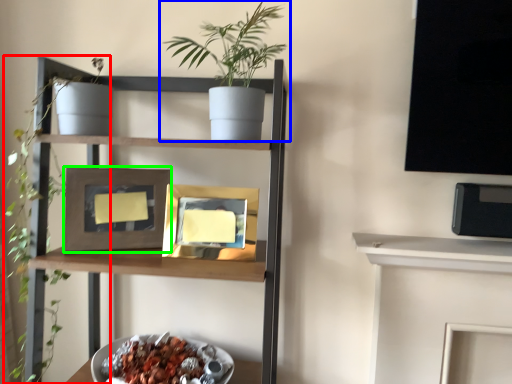
Question: Estimate the real-world distances between objects in this image. Which object is farther from plant (highlighted by a red box), houseplant (highlighted by a blue box) or picture frame (highlighted by a green box)?

Choices:
 (A) houseplant
 (B) picture frame

Answer: (A)